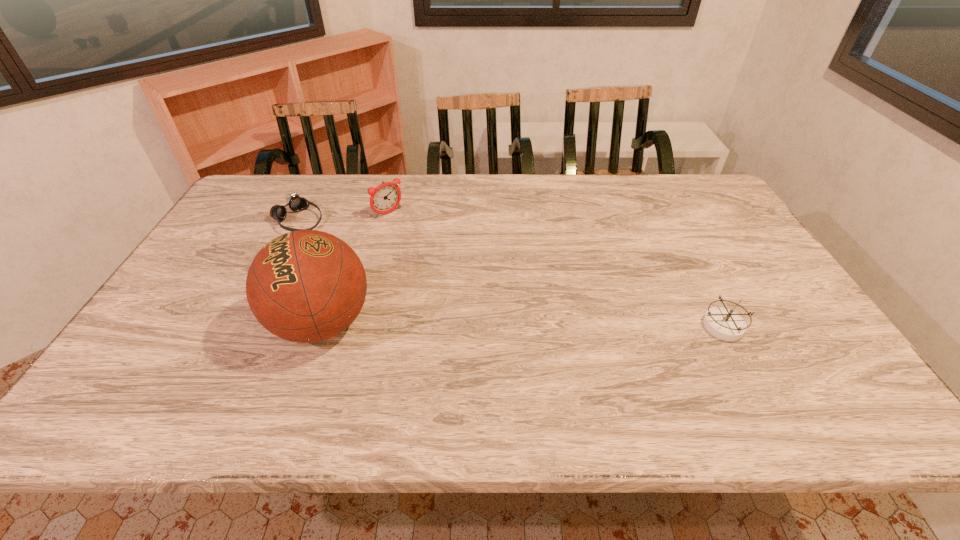
Locate an element on the screen. The width and height of the screenshot is (960, 540). free location located 0.090m through the lenses of the goggles is located at coordinates (333, 240).

You are a GUI agent. You are given a task and a screenshot of the screen. Output one action in this format:
    pyautogui.click(x=<x>, y=<y>)
    Task: Click on the vacant space located through the lenses of the goggles
    This screenshot has height=540, width=960.
    Given the screenshot: What is the action you would take?
    pyautogui.click(x=340, y=244)

At what (x,y) coordinates should I click in order to perform the action: click on alarm clock at the far edge. Please return your answer as a coordinate pair (x, y). This screenshot has height=540, width=960. Looking at the image, I should click on (384, 198).

The image size is (960, 540). I want to click on goggles at the far edge, so click(x=296, y=203).

Locate an element on the screen. Image resolution: width=960 pixels, height=540 pixels. object at the near edge is located at coordinates pyautogui.click(x=305, y=286).

The height and width of the screenshot is (540, 960). I want to click on object that is at the left edge, so click(x=296, y=203).

Find the location of a particular element. The width and height of the screenshot is (960, 540). object at the right edge is located at coordinates (724, 323).

The image size is (960, 540). What are the coordinates of `object positioned at the far left corner` in the screenshot? It's located at (296, 203).

Where is `vacant region at the far edge of the desktop`? Image resolution: width=960 pixels, height=540 pixels. vacant region at the far edge of the desktop is located at coordinates (505, 181).

This screenshot has width=960, height=540. In order to click on vacant space at the left edge in this screenshot , I will do `click(176, 313)`.